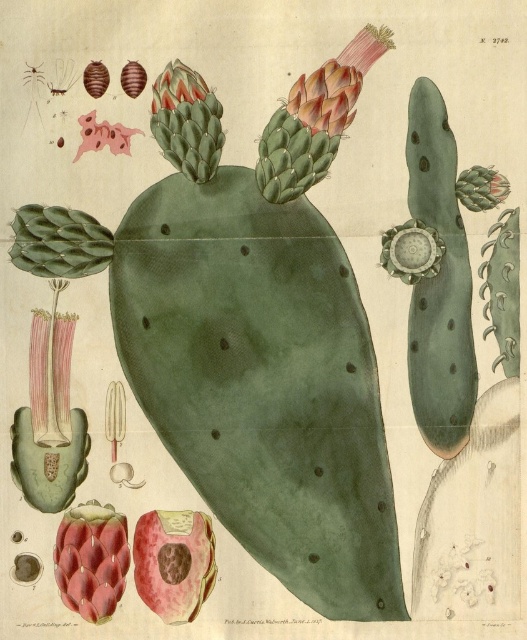
Question: Among these points, which one is farthest from the camera?

Choices:
 (A) (209, 108)
 (B) (318, 72)

Answer: (A)

Question: Can you confirm if green spiky cactus at upper center is positioned to the left of green matte flower at upper center?

Choices:
 (A) no
 (B) yes

Answer: (A)

Question: Which of the following is the closest to the observer?

Choices:
 (A) pos(113,140)
 (B) pos(307,84)

Answer: (B)

Question: Can you confirm if pink matte flower at lower left is thinner than green matte flower at upper center?

Choices:
 (A) no
 (B) yes

Answer: (A)

Question: Which of these objects is positioned closest to the green spiky cactus at upper center?

Choices:
 (A) pink matte flower at upper center
 (B) pink matte flower at center
 (C) pink matte flower at upper left
 (D) pink matte flower at lower left

Answer: (C)

Question: Is pink matte flower at upper center further to camera compared to pink matte flower at upper left?

Choices:
 (A) yes
 (B) no

Answer: (B)